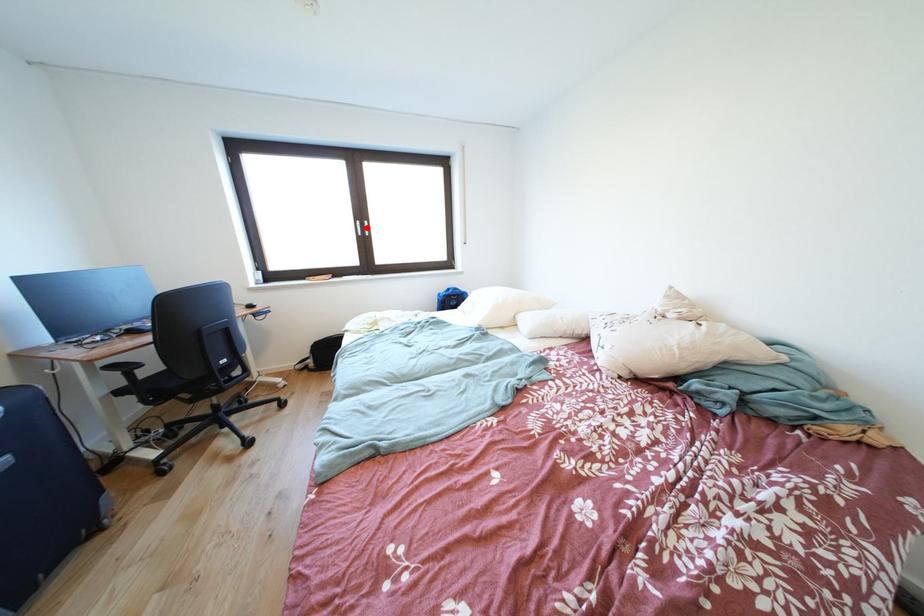
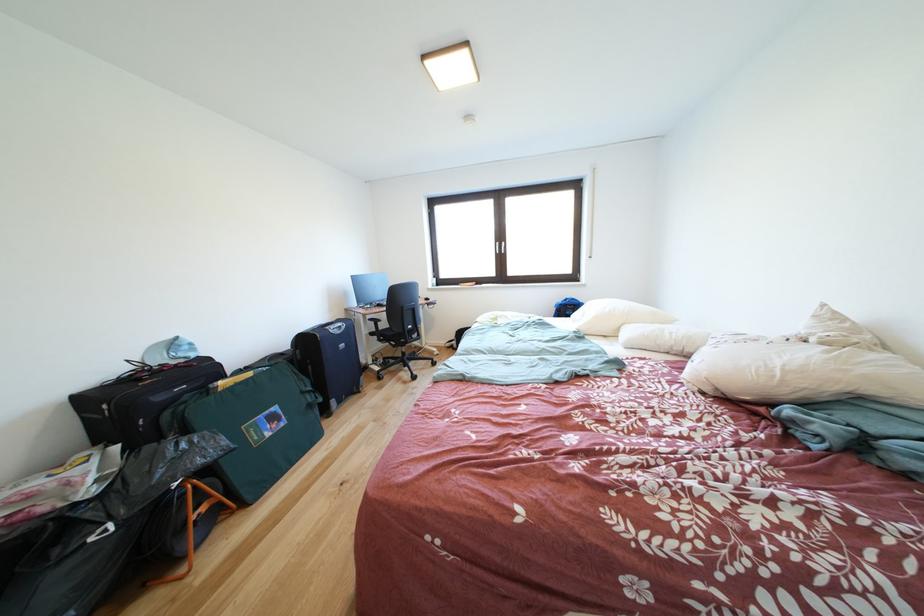
Question: I am providing you with two images of the same scene from different viewpoints. A red point is shown in image1. For the corresponding object point in image2, is it positioned nearer or farther from the camera?

Choices:
 (A) Nearer
 (B) Farther

Answer: (B)